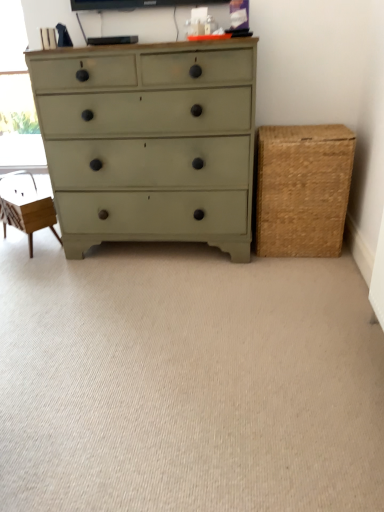
Question: From a real-world perspective, is braided wicker basket at right under satin green dresser at center?

Choices:
 (A) yes
 (B) no

Answer: (A)

Question: Does braided wicker basket at right touch satin green dresser at center?

Choices:
 (A) no
 (B) yes

Answer: (A)

Question: Is braided wicker basket at right positioned with its back to satin green dresser at center?

Choices:
 (A) no
 (B) yes

Answer: (A)

Question: Is braided wicker basket at right smaller than satin green dresser at center?

Choices:
 (A) yes
 (B) no

Answer: (A)

Question: From a real-world perspective, is braided wicker basket at right physically above satin green dresser at center?

Choices:
 (A) yes
 (B) no

Answer: (B)

Question: Is beige carpet at center wider or thinner than braided wicker basket at right?

Choices:
 (A) wide
 (B) thin

Answer: (A)

Question: Considering their positions, is beige carpet at center located in front of or behind braided wicker basket at right?

Choices:
 (A) front
 (B) behind

Answer: (A)

Question: Is point (64, 459) closer or farther from the camera than point (273, 151)?

Choices:
 (A) farther
 (B) closer

Answer: (B)

Question: Based on their sizes in the image, would you say beige carpet at center is bigger or smaller than braided wicker basket at right?

Choices:
 (A) small
 (B) big

Answer: (B)

Question: In terms of height, does wooden swivel chair at left look taller or shorter compared to satin green dresser at center?

Choices:
 (A) short
 (B) tall

Answer: (A)

Question: Is wooden swivel chair at left inside or outside of satin green dresser at center?

Choices:
 (A) outside
 (B) inside

Answer: (A)

Question: In the image, is wooden swivel chair at left positioned in front of or behind satin green dresser at center?

Choices:
 (A) front
 (B) behind

Answer: (B)

Question: From the image's perspective, is wooden swivel chair at left above or below satin green dresser at center?

Choices:
 (A) below
 (B) above

Answer: (A)

Question: Looking at the image, does transparent glass window screen at upper left seem bigger or smaller compared to braided wicker basket at right?

Choices:
 (A) small
 (B) big

Answer: (A)

Question: In the image, is transparent glass window screen at upper left positioned in front of or behind braided wicker basket at right?

Choices:
 (A) behind
 (B) front

Answer: (A)